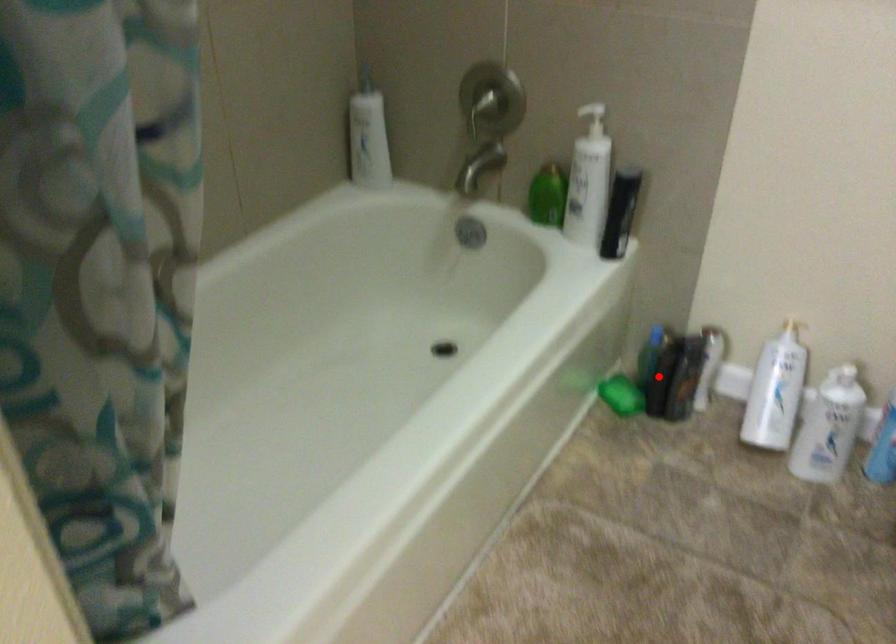
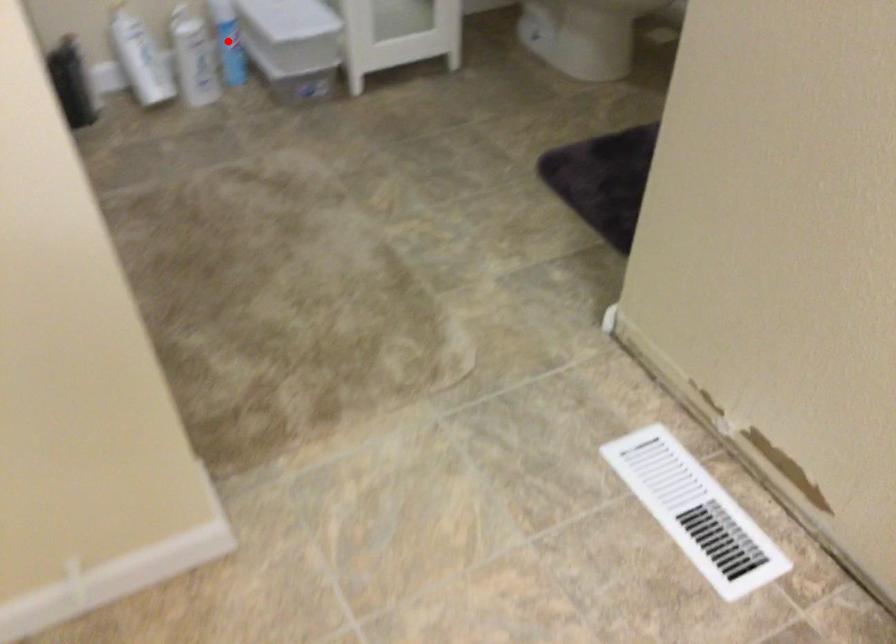
I am providing you with two images of the same scene from different viewpoints. A red point is marked on the first image and another point is marked on the second image. Is the marked point in image1 the same physical position as the marked point in image2?

No